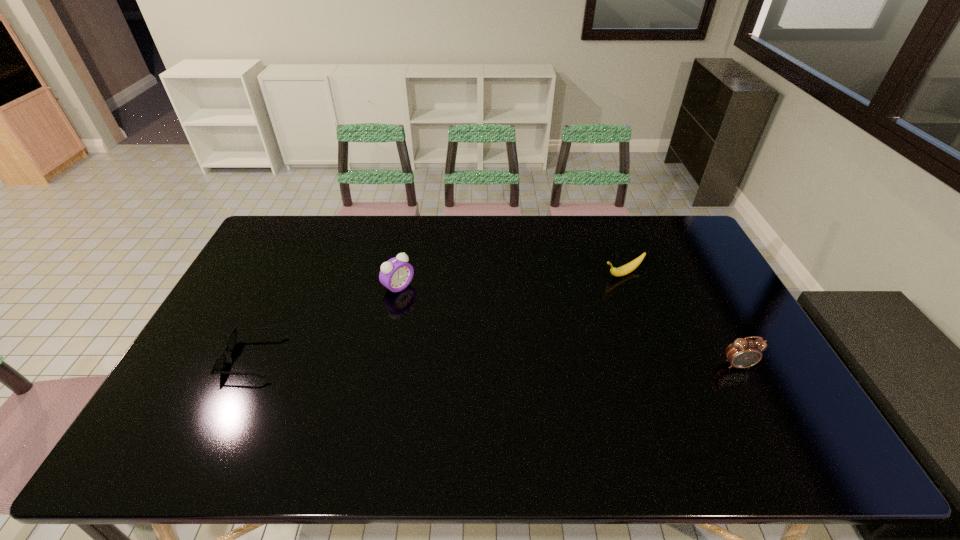
This screenshot has height=540, width=960. In order to click on free location at the right edge of the desktop in this screenshot , I will do `click(718, 280)`.

The image size is (960, 540). I want to click on vacant space at the near left corner of the desktop, so click(x=156, y=420).

You are a GUI agent. You are given a task and a screenshot of the screen. Output one action in this format:
    pyautogui.click(x=<x>, y=<y>)
    Task: Click on the vacant space at the near right corner
    This screenshot has height=540, width=960.
    Given the screenshot: What is the action you would take?
    pyautogui.click(x=794, y=403)

Where is `empty location between the third object from left to right and the rightmost object`? The width and height of the screenshot is (960, 540). empty location between the third object from left to right and the rightmost object is located at coordinates (680, 319).

You are a GUI agent. You are given a task and a screenshot of the screen. Output one action in this format:
    pyautogui.click(x=<x>, y=<y>)
    Task: Click on the vacant space that is in between the right alarm clock and the third tallest object
    
    Given the screenshot: What is the action you would take?
    pyautogui.click(x=680, y=319)

This screenshot has width=960, height=540. What are the coordinates of `empty space between the third tallest object and the farther alarm clock` in the screenshot? It's located at (511, 280).

At what (x,y) coordinates should I click in order to perform the action: click on empty location between the shortest object and the rightmost object. Please return your answer as a coordinate pair (x, y). This screenshot has height=540, width=960. Looking at the image, I should click on (495, 361).

Image resolution: width=960 pixels, height=540 pixels. I want to click on free space between the shortest object and the rightmost object, so click(495, 361).

Identify the location of vacant region between the second object from left to right and the shortest object. The height and width of the screenshot is (540, 960). pyautogui.click(x=326, y=322).

Locate an element on the screen. empty location between the left alarm clock and the right alarm clock is located at coordinates (568, 326).